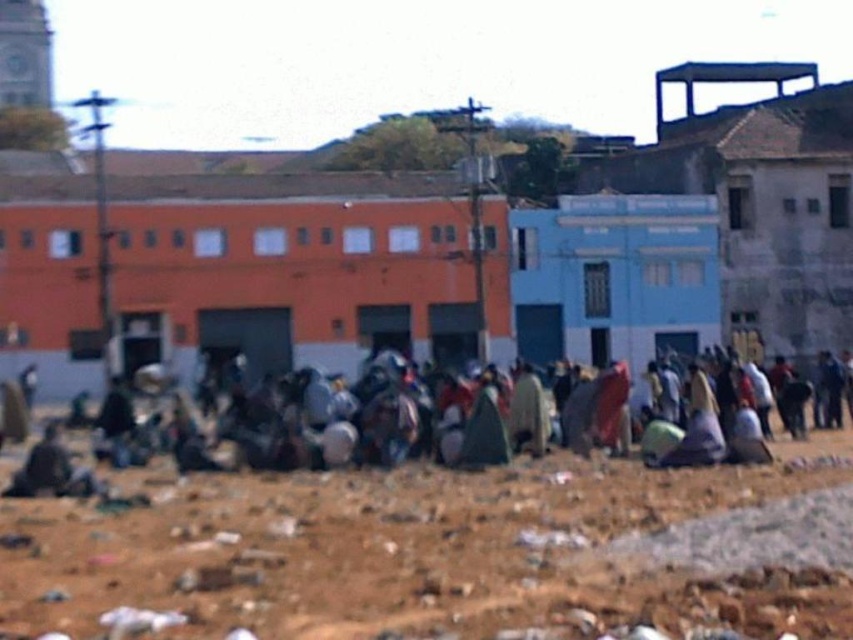
You are a delivery person trying to place a heavy box on a stable surface. You see the brown sandy dirt at center and the green fabric cloth at center. Which surface would be more stable for placing the box?

The brown sandy dirt at center is located below the green fabric cloth at center, so the brown sandy dirt at center is more stable for placing the box since it is a solid ground, while the green fabric cloth at center might be unstable as it is likely a cloth material.

You are standing at the point marked by the coordinates point (448, 552) in the image. What type of terrain are you currently standing on?

The point (448, 552) marks brown sandy dirt at center, so you are standing on brown sandy dirt.

You are a delivery person who needs to place a package on the green fabric cloth at center without stepping on the brown sandy dirt at center. The package is 1.5 meters wide. Can you place the package between them?

The brown sandy dirt at center is 1.68 meters from the green fabric cloth at center. Since the package is 1.5 meters wide, it can fit between them without stepping on the brown sandy dirt at center.